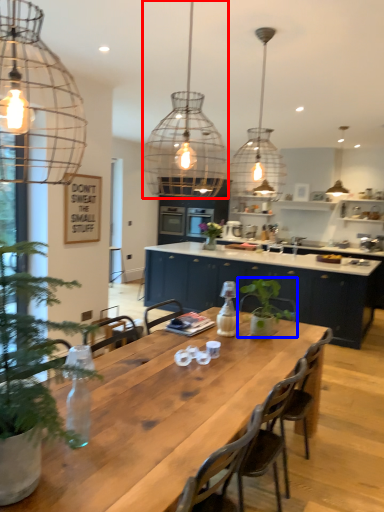
Question: Which of the following is the closest to the observer, light fixture (highlighted by a red box) or houseplant (highlighted by a blue box)?

Choices:
 (A) light fixture
 (B) houseplant

Answer: (A)